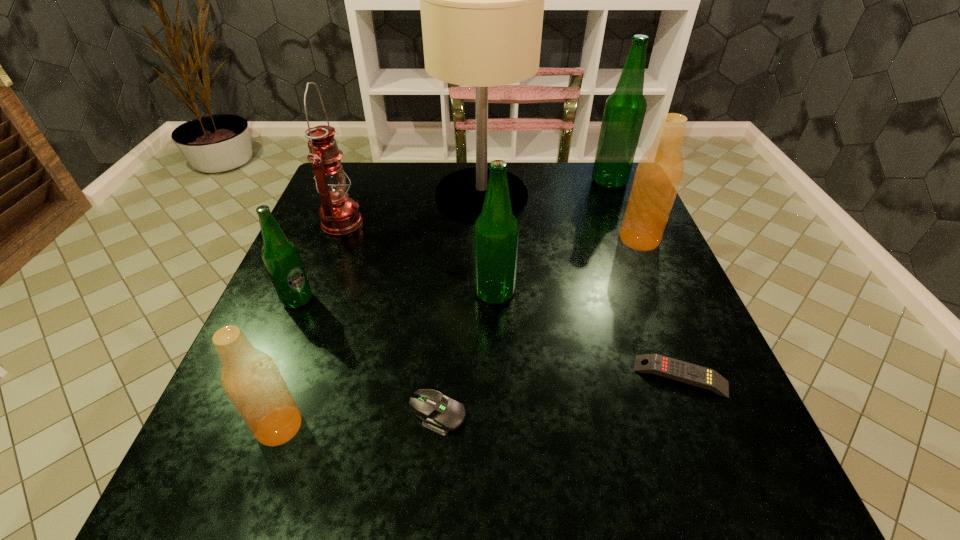
The image size is (960, 540). Find the location of `oil lamp that is at the far edge`. oil lamp that is at the far edge is located at coordinates (339, 214).

Image resolution: width=960 pixels, height=540 pixels. Find the location of `oil lamp located in the left edge section of the desktop`. oil lamp located in the left edge section of the desktop is located at coordinates (339, 214).

You are a GUI agent. You are given a task and a screenshot of the screen. Output one action in this format:
    pyautogui.click(x=<x>, y=<y>)
    Task: Click on the remote control positioned at the right edge
    This screenshot has height=540, width=960.
    Given the screenshot: What is the action you would take?
    pyautogui.click(x=685, y=372)

Identify the location of object that is at the far left corner. This screenshot has width=960, height=540. (339, 214).

Where is `object at the far right corner`? object at the far right corner is located at coordinates (624, 112).

Locate an element on the screen. This screenshot has width=960, height=540. vacant area at the far edge is located at coordinates (564, 186).

The width and height of the screenshot is (960, 540). In the image, there is a desktop. Find the location of `vacant region at the near edge`. vacant region at the near edge is located at coordinates (450, 516).

The image size is (960, 540). I want to click on vacant region at the right edge, so click(643, 389).

In the image, there is a desktop. Identify the location of free space at the far right corner. This screenshot has height=540, width=960. (625, 186).

Where is `free space at the near right corner`? The height and width of the screenshot is (540, 960). free space at the near right corner is located at coordinates (665, 459).